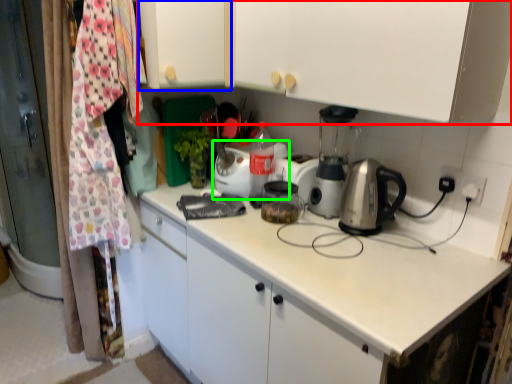
Question: Which object is positioned farthest from cabinetry (highlighted by a red box)? Select from cabinetry (highlighted by a blue box) and kitchen appliance (highlighted by a green box).

Choices:
 (A) cabinetry
 (B) kitchen appliance

Answer: (B)